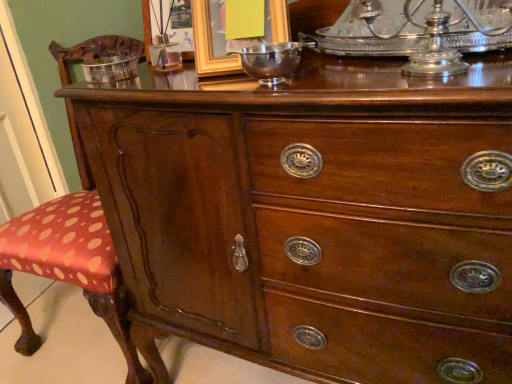
Where is `vacant area that is in front of silver metallic bowl at upper left`? Image resolution: width=512 pixels, height=384 pixels. vacant area that is in front of silver metallic bowl at upper left is located at coordinates (123, 89).